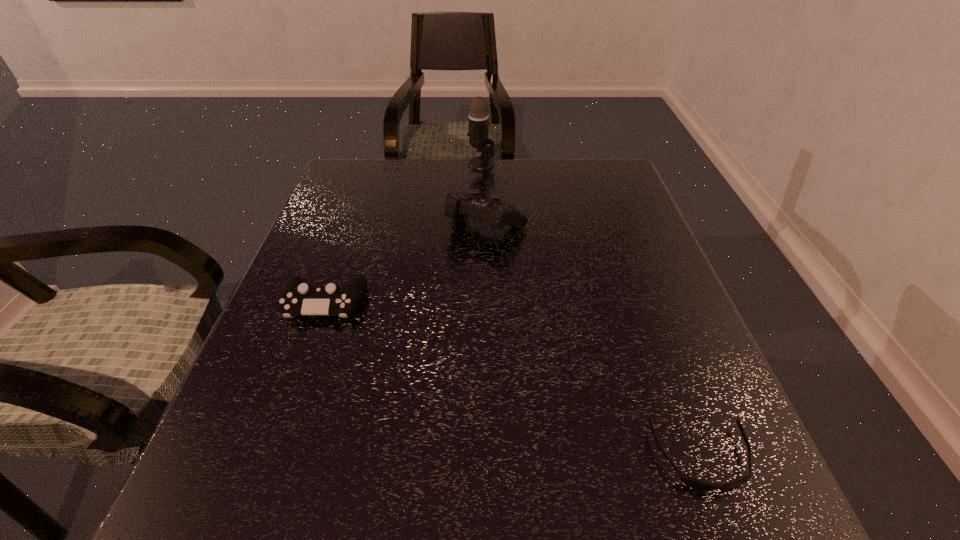
Identify the location of vacant space located 0.090m on the surface of the left control. (304, 361).

Locate an element on the screen. The image size is (960, 540). object situated at the far edge is located at coordinates [x=478, y=133].

The width and height of the screenshot is (960, 540). Find the location of `object that is at the near edge`. object that is at the near edge is located at coordinates (695, 484).

Where is `object at the left edge`? The height and width of the screenshot is (540, 960). object at the left edge is located at coordinates coord(298,298).

Find the location of a particular element. Image resolution: width=960 pixels, height=540 pixels. object located at the right edge is located at coordinates (695, 484).

Locate an element on the screen. object that is at the near right corner is located at coordinates (695, 484).

This screenshot has width=960, height=540. In the image, there is a desktop. Find the location of `vacant area at the far edge`. vacant area at the far edge is located at coordinates (527, 173).

In the image, there is a desktop. Where is `vacant space at the near edge`? vacant space at the near edge is located at coordinates (464, 490).

Find the location of a particular element. The width and height of the screenshot is (960, 540). vacant space at the left edge is located at coordinates (371, 240).

In the image, there is a desktop. Identify the location of blank space at the right edge. coord(719,401).